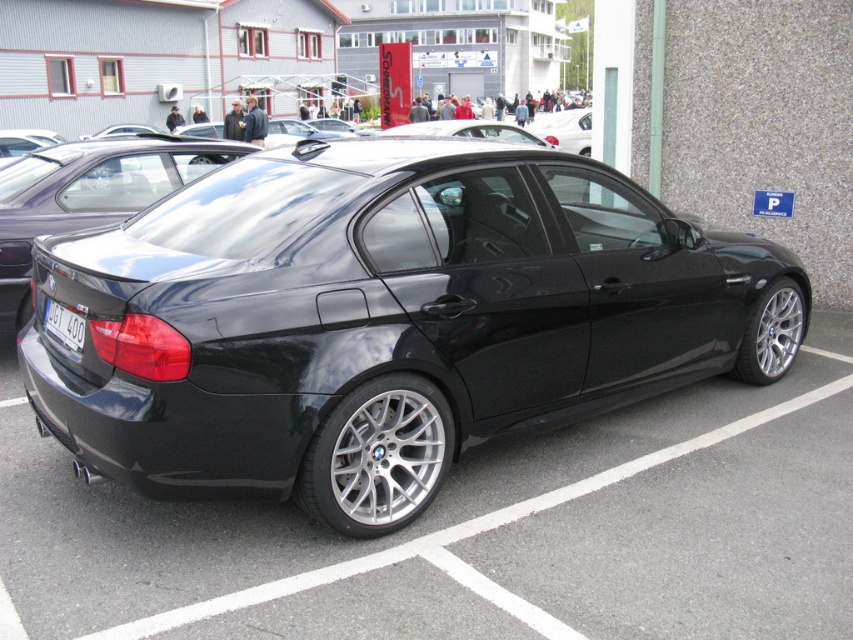
Between black metallic sedan at center and glossy black car at center, which one is positioned higher?

Positioned higher is black metallic sedan at center.

Which is below, black metallic sedan at center or glossy black car at center?

glossy black car at center is lower down.

Identify the location of black metallic sedan at center. This screenshot has width=853, height=640. (386, 317).

Where is `glossy black sedan at center`? The width and height of the screenshot is (853, 640). glossy black sedan at center is located at coordinates (86, 195).

Is glossy black car at center to the left of white plastic license plate at rear from the viewer's perspective?

Incorrect, glossy black car at center is not on the left side of white plastic license plate at rear.

Consider the image. Who is higher up, glossy black car at center or white plastic license plate at rear?

white plastic license plate at rear

Is point (74, 593) farther from camera compared to point (80, 336)?

No, (74, 593) is closer to viewer.

The width and height of the screenshot is (853, 640). I want to click on glossy black car at center, so coord(480,532).